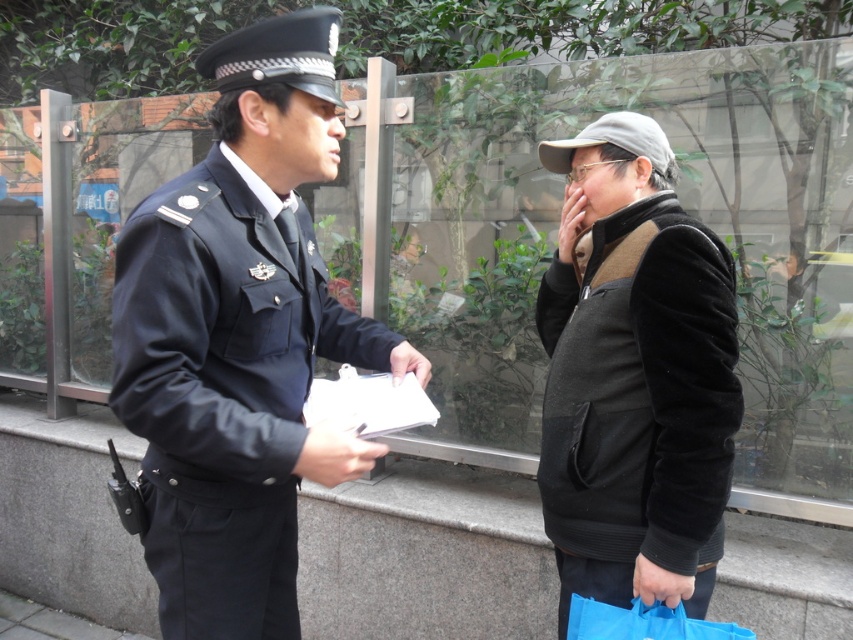
You are a pedestrian walking from left to right across the scene. Which object will you encounter first, the matte black uniform at center or the velvet black vest at right?

The matte black uniform at center is to the left of the velvet black vest at right, so you will encounter the matte black uniform at center first as you walk from left to right.

You are a delivery person who needs to leave a package between the matte black uniform at center and the velvet black vest at right. The package is 50 centimeters long. Can you fit it there?

The distance between the matte black uniform at center and the velvet black vest at right is 52.75 centimeters. Since the package is 50 centimeters long, it can fit in the space between them.